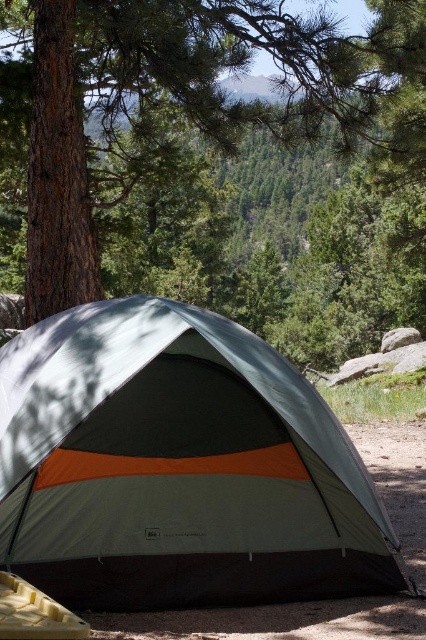
Question: From the image, what is the correct spatial relationship of green rough bark tree at center in relation to orange fabric tent at center?

Choices:
 (A) left
 (B) right

Answer: (B)

Question: Can you confirm if green rough bark tree at center is smaller than orange fabric tent at center?

Choices:
 (A) yes
 (B) no

Answer: (B)

Question: Among these points, which one is nearest to the camera?

Choices:
 (A) (49, 20)
 (B) (40, 573)

Answer: (B)

Question: Which object is farther from the camera taking this photo?

Choices:
 (A) green rough bark tree at center
 (B) orange fabric tent at center

Answer: (A)

Question: Does green rough bark tree at center have a lesser width compared to orange fabric tent at center?

Choices:
 (A) yes
 (B) no

Answer: (B)